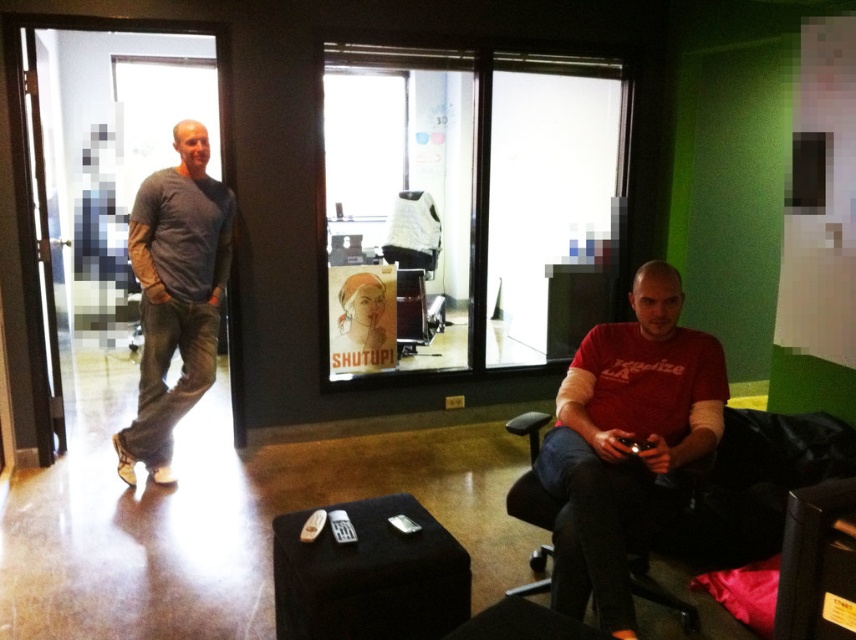
Which is behind, point (87, 134) or point (531, 497)?

The point (87, 134) is more distant.

Which is below, transparent glass door at left or black leather armchair at right?

black leather armchair at right

At what (x,y) coordinates should I click in order to perform the action: click on transparent glass door at left. Please return your answer as a coordinate pair (x, y). The height and width of the screenshot is (640, 856). Looking at the image, I should click on (98, 161).

This screenshot has width=856, height=640. What do you see at coordinates (98, 161) in the screenshot?
I see `transparent glass door at left` at bounding box center [98, 161].

Who is more distant from viewer, [111,93] or [278,625]?

The point [111,93] is behind.

What are the coordinates of `transparent glass door at left` in the screenshot? It's located at (98, 161).

Between matte red shirt at center and black leather armchair at right, which one has more height?

matte red shirt at center is taller.

I want to click on matte red shirt at center, so click(626, 438).